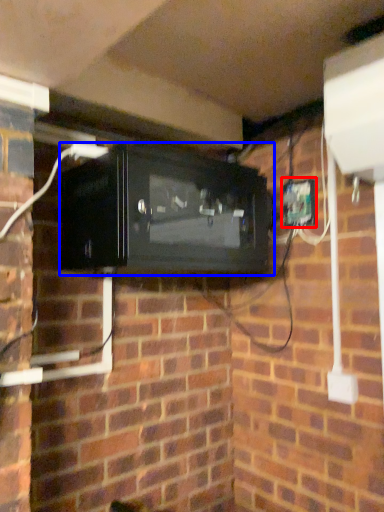
Question: Which point is closer to the camera, electric outlet (highlighted by a red box) or appliance (highlighted by a blue box)?

Choices:
 (A) electric outlet
 (B) appliance

Answer: (B)